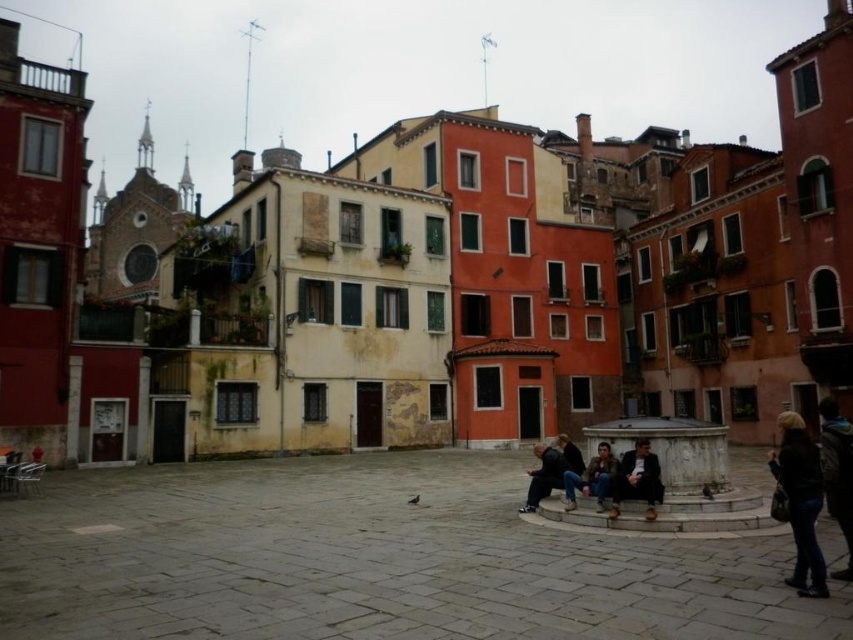
You are a photographer positioned at the edge of the square, aiming to capture both the dark brown leather jacket at lower right and the matte black jacket at lower center in your shot. Which jacket will appear closer to the camera in the photograph?

The dark brown leather jacket at lower right will appear closer to the camera because it is positioned in front of the matte black jacket at lower center.